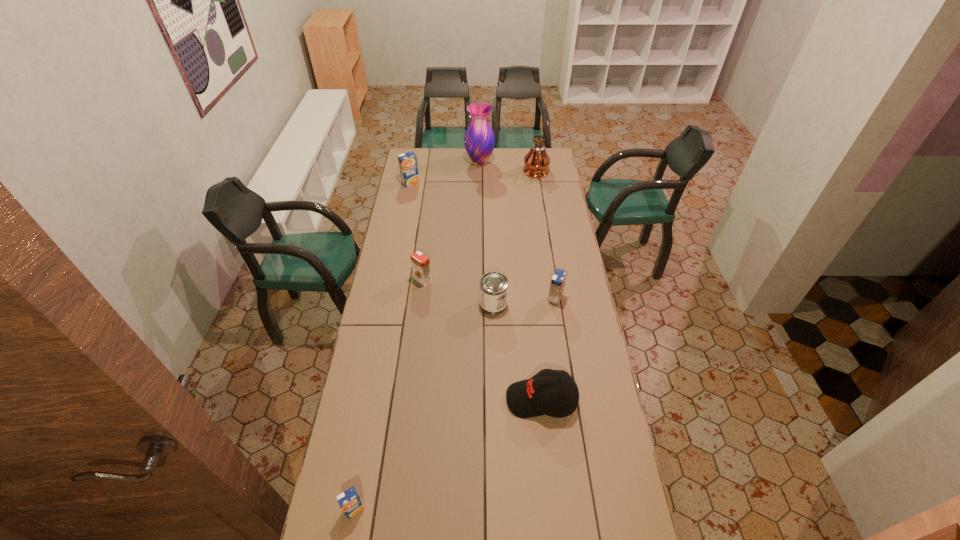
Where is `vacant space located 0.380m on the front-facing side of the baseball cap`? The image size is (960, 540). vacant space located 0.380m on the front-facing side of the baseball cap is located at coordinates (400, 400).

Where is `free space located 0.340m on the front-facing side of the baseball cap`? This screenshot has width=960, height=540. free space located 0.340m on the front-facing side of the baseball cap is located at coordinates (411, 400).

Find the location of `free space located on the front-facing side of the baseball cap`. free space located on the front-facing side of the baseball cap is located at coordinates (436, 400).

Find the location of a particular element. The width and height of the screenshot is (960, 540). vacant space located 0.260m on the right of the smallest blue orange_juice is located at coordinates (451, 509).

Locate an element on the screen. The height and width of the screenshot is (540, 960). oil lamp at the far edge is located at coordinates (536, 161).

Find the location of a particular element. vase at the far edge is located at coordinates coord(479,140).

The image size is (960, 540). I want to click on oil lamp at the right edge, so click(x=536, y=161).

Identify the location of orange_juice that is at the right edge. The image size is (960, 540). (558, 280).

You are a GUI agent. You are given a task and a screenshot of the screen. Output one action in this format:
    pyautogui.click(x=<x>, y=<y>)
    Task: Click on the baseball cap at the right edge
    The width and height of the screenshot is (960, 540).
    Given the screenshot: What is the action you would take?
    pyautogui.click(x=554, y=393)

This screenshot has width=960, height=540. I want to click on object situated at the far right corner, so click(536, 161).